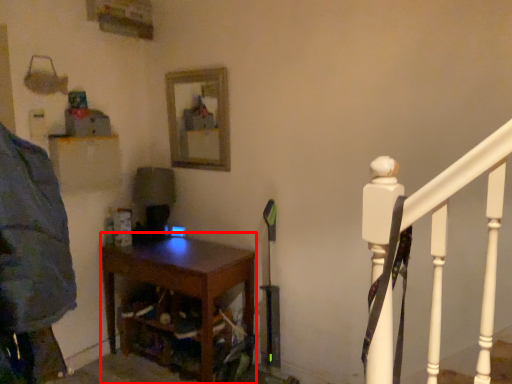
Question: From the image's perspective, what is the correct spatial positioning of nightstand (annotated by the red box) in reference to mirror?

Choices:
 (A) above
 (B) below

Answer: (B)